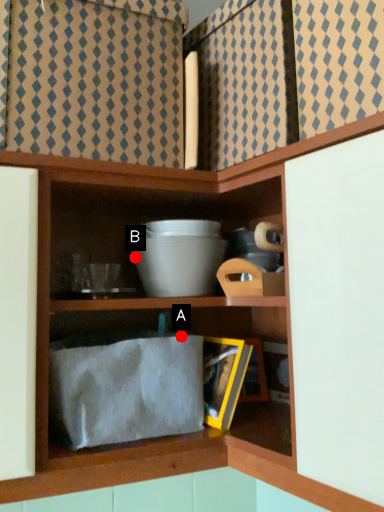
Question: Two points are circled on the image, labeled by A and B beside each circle. Which point is closer to the camera?

Choices:
 (A) A is closer
 (B) B is closer

Answer: (A)